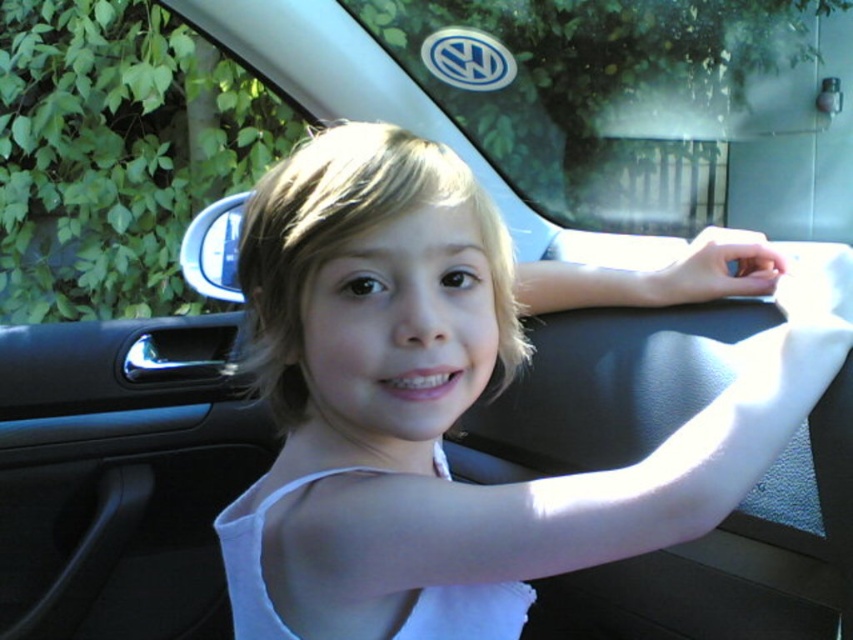
Question: From the image, what is the correct spatial relationship of white fabric at center in relation to transparent glass window at upper left?

Choices:
 (A) above
 (B) below

Answer: (B)

Question: Is white fabric at center above transparent glass window at upper left?

Choices:
 (A) no
 (B) yes

Answer: (A)

Question: Which of the following is the farthest from the observer?

Choices:
 (A) (241, 93)
 (B) (625, 282)

Answer: (A)

Question: Does white fabric at center appear over transparent glass window at upper left?

Choices:
 (A) yes
 (B) no

Answer: (B)